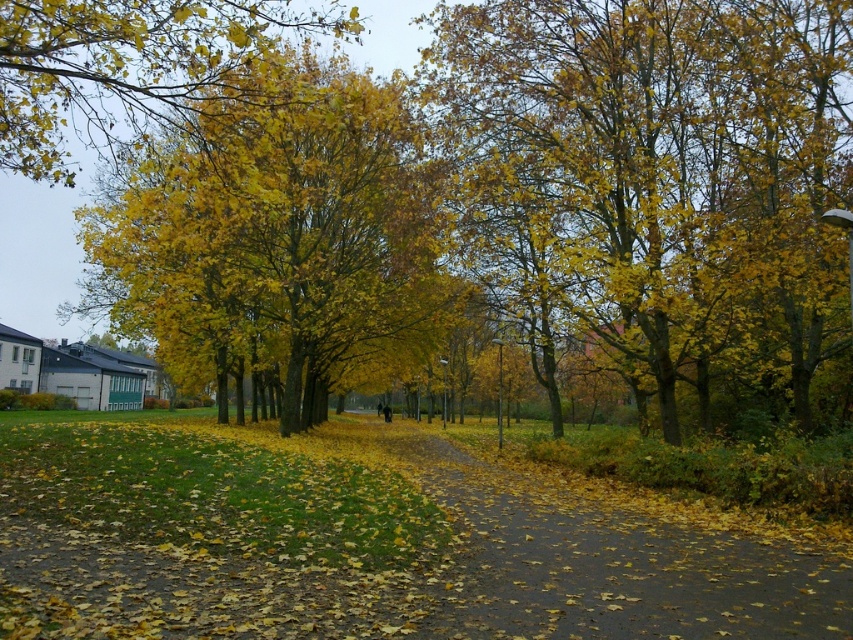
You are standing on the pathway in the autumn scene and want to walk towards the point labeled point (550, 344). Which direction should you go relative to the other point labeled point (96, 81)?

You should walk towards the point labeled point (550, 344), which is closer to you compared to point (96, 81).

You are standing at the starting point of the pathway in the autumn scene. You see two points marked on the path ahead. One is at coordinates point [575,522] and the other is at point [70,163]. Which point is closer to you as you begin walking along the path?

Point [575,522] is closer to the viewer than point [70,163], so the point at coordinates point [575,522] is closer to you as you begin walking along the path.